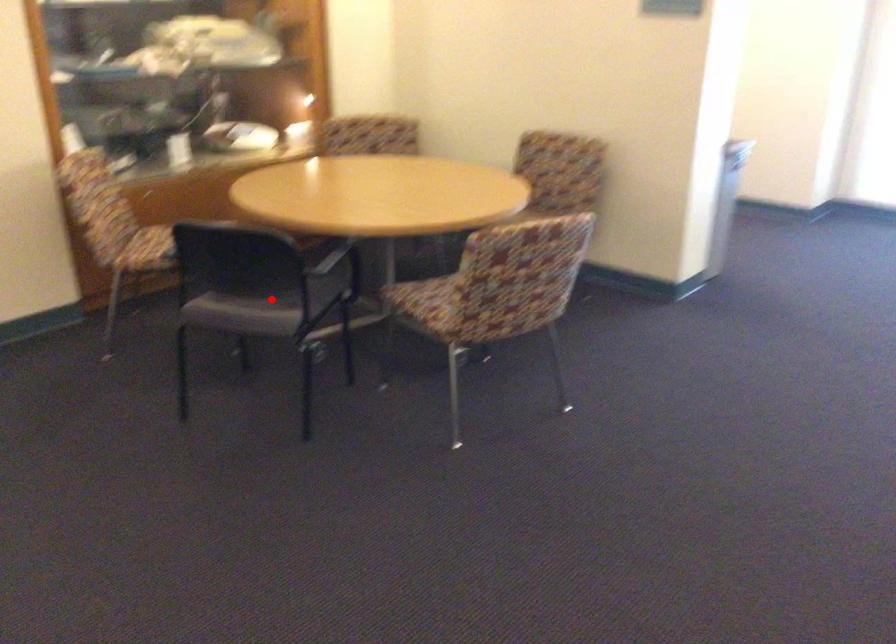
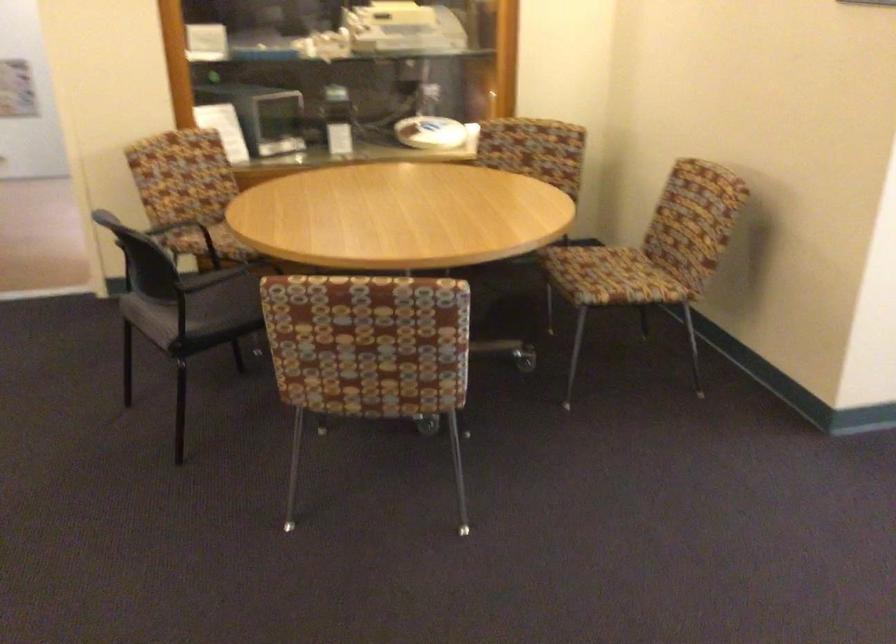
The point at the highlighted location is marked in the first image. Where is the corresponding point in the second image?

(213, 301)